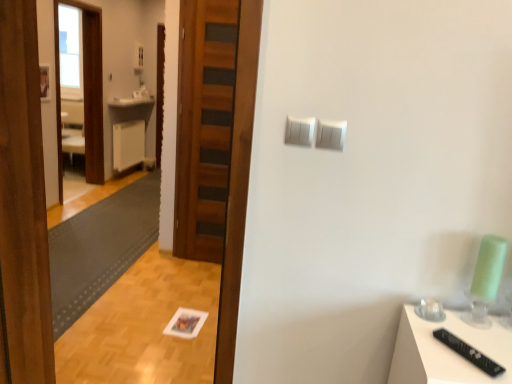
Question: Would you say white glossy counter top at center contains wooden door at center?

Choices:
 (A) no
 (B) yes

Answer: (A)

Question: Considering the relative positions of white glossy counter top at center and wooden door at center in the image provided, is white glossy counter top at center to the right of wooden door at center from the viewer's perspective?

Choices:
 (A) no
 (B) yes

Answer: (A)

Question: Considering the relative sizes of white glossy counter top at center and wooden door at center in the image provided, is white glossy counter top at center thinner than wooden door at center?

Choices:
 (A) no
 (B) yes

Answer: (A)

Question: From a real-world perspective, is white glossy counter top at center physically above wooden door at center?

Choices:
 (A) yes
 (B) no

Answer: (B)

Question: Is white glossy counter top at center turned away from wooden door at center?

Choices:
 (A) yes
 (B) no

Answer: (B)

Question: Visually, is white glossy counter top at center positioned to the left or to the right of white plastic light switch at upper center, which is the 2th light switch in right-to-left order?

Choices:
 (A) right
 (B) left

Answer: (B)

Question: From a real-world perspective, is white glossy counter top at center physically located above or below white plastic light switch at upper center, positioned as the 1th light switch in left-to-right order?

Choices:
 (A) below
 (B) above

Answer: (A)

Question: In terms of size, does white glossy counter top at center appear bigger or smaller than white plastic light switch at upper center, which is the 2th light switch in right-to-left order?

Choices:
 (A) big
 (B) small

Answer: (A)

Question: Is white glossy counter top at center taller or shorter than white plastic light switch at upper center, positioned as the 1th light switch in left-to-right order?

Choices:
 (A) tall
 (B) short

Answer: (B)

Question: Is dark gray textured mat at lower left bigger or smaller than white plastic light switch at upper center, the second light switch positioned from the left?

Choices:
 (A) big
 (B) small

Answer: (A)

Question: Considering the positions of dark gray textured mat at lower left and white plastic light switch at upper center, the second light switch positioned from the left, in the image, is dark gray textured mat at lower left taller or shorter than white plastic light switch at upper center, the second light switch positioned from the left,?

Choices:
 (A) tall
 (B) short

Answer: (B)

Question: Is dark gray textured mat at lower left in front of or behind white plastic light switch at upper center, which is the 1th light switch in right-to-left order, in the image?

Choices:
 (A) behind
 (B) front

Answer: (A)

Question: Considering the relative positions of dark gray textured mat at lower left and white plastic light switch at upper center, the second light switch positioned from the left, in the image provided, is dark gray textured mat at lower left to the left or to the right of white plastic light switch at upper center, the second light switch positioned from the left,?

Choices:
 (A) right
 (B) left

Answer: (B)

Question: Considering the positions of wooden screen door at left and white plastic light switch at upper center, the second light switch positioned from the left, in the image, is wooden screen door at left wider or thinner than white plastic light switch at upper center, the second light switch positioned from the left,?

Choices:
 (A) wide
 (B) thin

Answer: (A)

Question: From their relative heights in the image, would you say wooden screen door at left is taller or shorter than white plastic light switch at upper center, the second light switch positioned from the left?

Choices:
 (A) tall
 (B) short

Answer: (A)